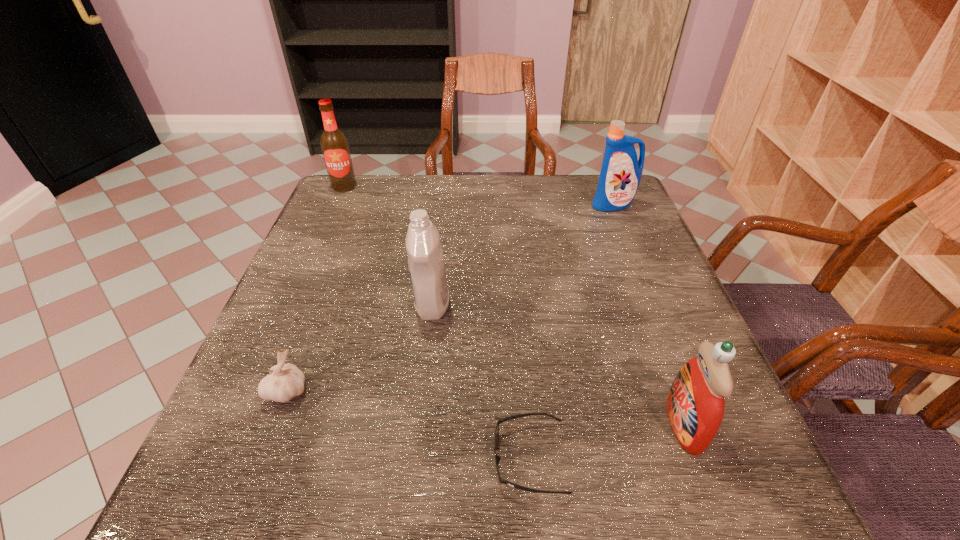
You are a GUI agent. You are given a task and a screenshot of the screen. Output one action in this format:
    pyautogui.click(x=<x>, y=<y>)
    Task: Click on the farthest object
    This screenshot has height=540, width=960.
    Given the screenshot: What is the action you would take?
    pyautogui.click(x=335, y=148)

The height and width of the screenshot is (540, 960). In order to click on the farthest detergent in this screenshot , I will do `click(621, 172)`.

The height and width of the screenshot is (540, 960). I want to click on the fourth nearest object, so (x=426, y=265).

The height and width of the screenshot is (540, 960). In order to click on the third object from left to right in this screenshot , I will do `click(426, 265)`.

Identify the location of the nearest detergent. (695, 404).

The width and height of the screenshot is (960, 540). I want to click on the fifth tallest object, so click(x=285, y=381).

Image resolution: width=960 pixels, height=540 pixels. I want to click on the fourth object from left to right, so click(x=497, y=458).

Identify the location of sunglasses. (497, 458).

The width and height of the screenshot is (960, 540). What are the coordinates of `free point located on the front of the beer bottle` in the screenshot? It's located at (304, 278).

I want to click on free space located on the label of the farthest detergent, so click(634, 255).